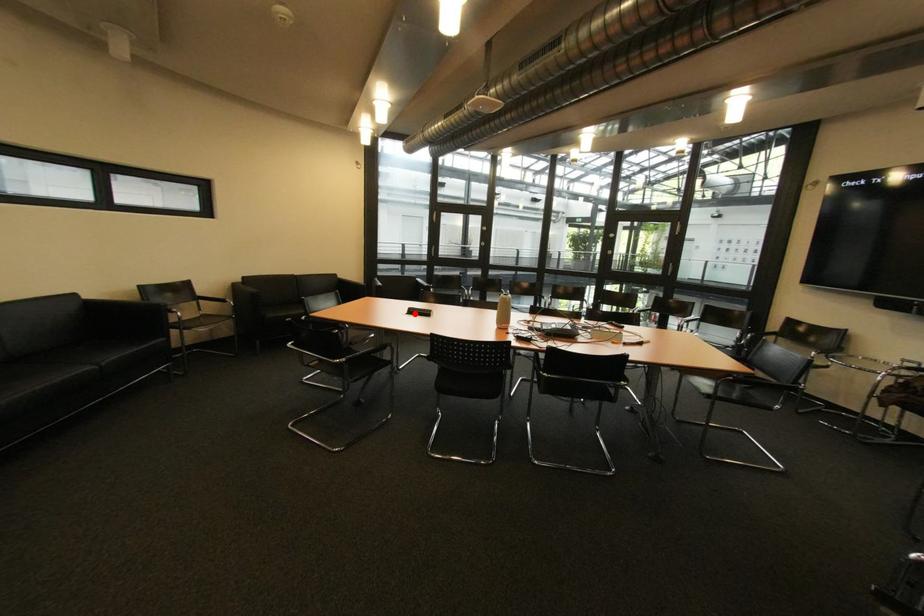
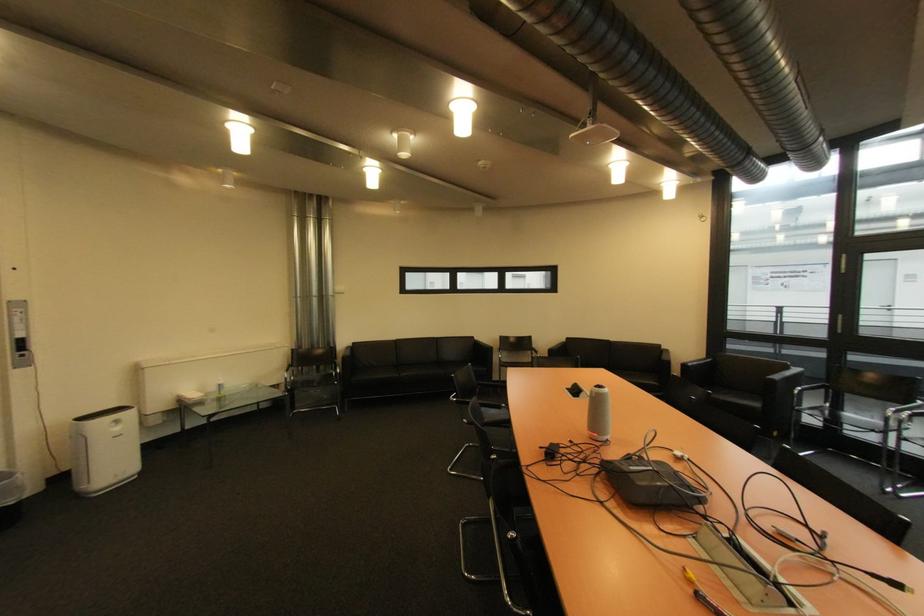
Locate, in the second image, the point that corresponds to the highlighted location in the first image.

(578, 389)